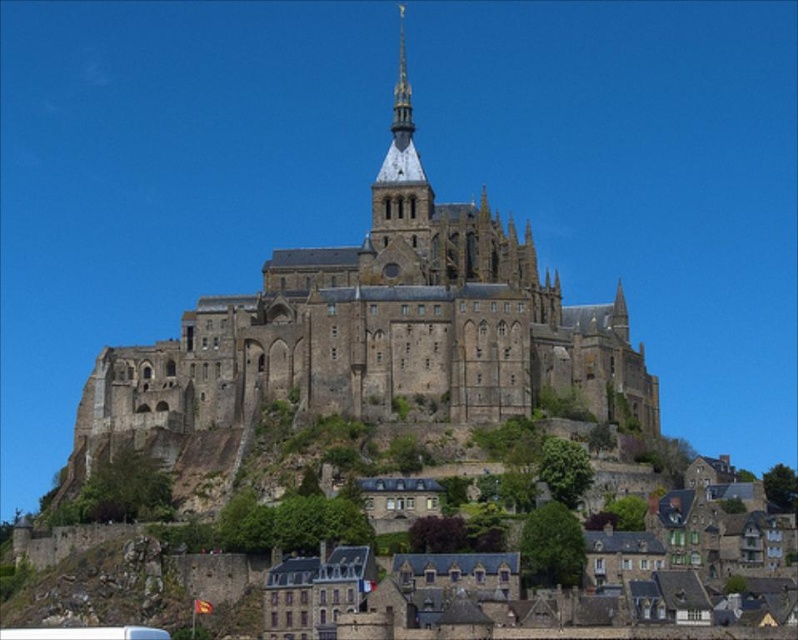
You are a tourist standing at the base of the stone castle at center, looking up towards the abbey. You notice a white plastic bus at lower left in the distance. Which object appears taller from your vantage point?

The stone castle at center appears taller than the white plastic bus at lower left from your vantage point because the stone castle at center has a greater height compared to the white plastic bus at lower left.

You are a tour guide explaining the Mont Saint Michel to visitors. You mention the stone castle at center and the white plastic bus at lower left. Which one is wider according to the description?

The stone castle at center might be wider than white plastic bus at lower left according to the description.